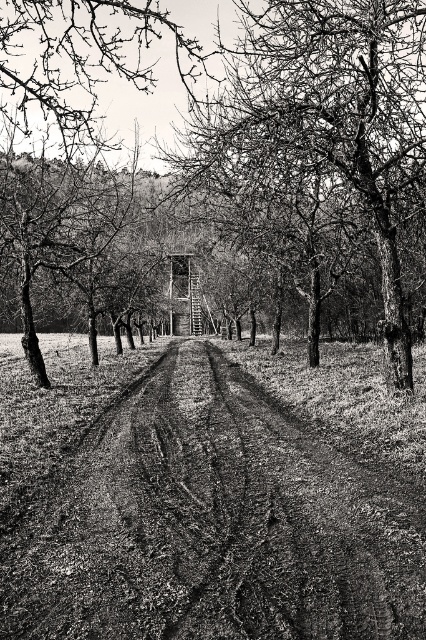
You are a hiker trying to decide which object to take a closer look at. The dirt track at center and the smooth bark tree at center are both in your view. Based on their sizes in the image, which one would you estimate to be farther away from you?

The dirt track at center is smaller than the smooth bark tree at center, so the dirt track at center is farther away because smaller objects in the distance appear smaller.

You are a hiker who wants to take a photo of the dirt track at center and the smooth bark tree at center. Which object should you focus on if you want to capture the taller one in your shot?

The smooth bark tree at center is taller than the dirt track at center, so you should focus on the smooth bark tree at center to capture the taller one in your shot.